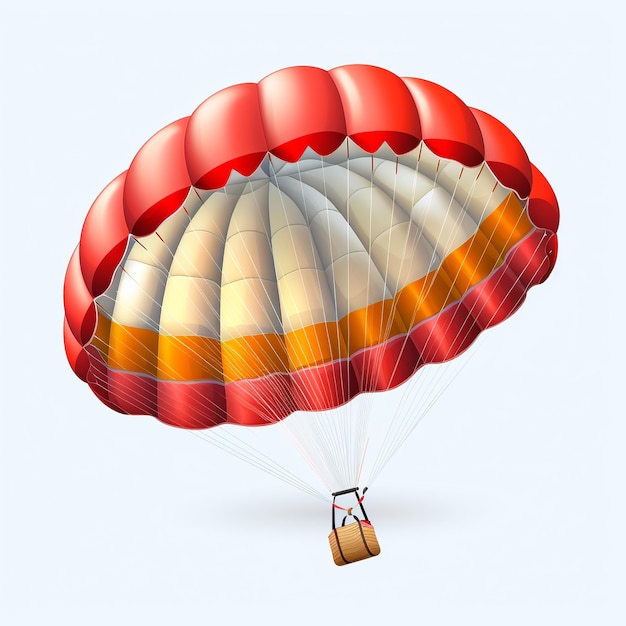
Where is `cable`? This screenshot has height=626, width=626. cable is located at coordinates (386, 389).